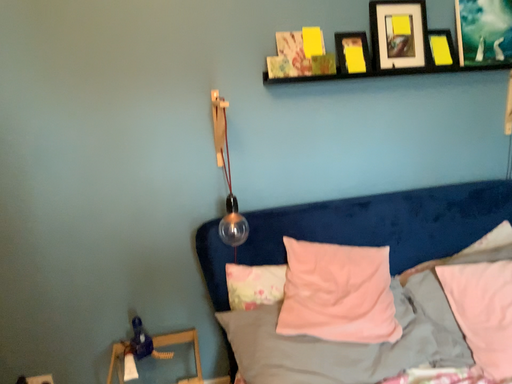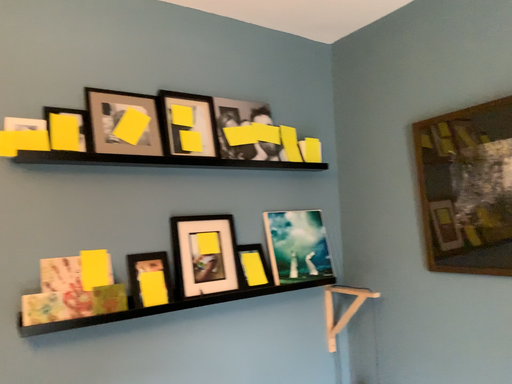
Question: How did the camera likely rotate when shooting the video?

Choices:
 (A) rotated upward
 (B) rotated downward

Answer: (A)